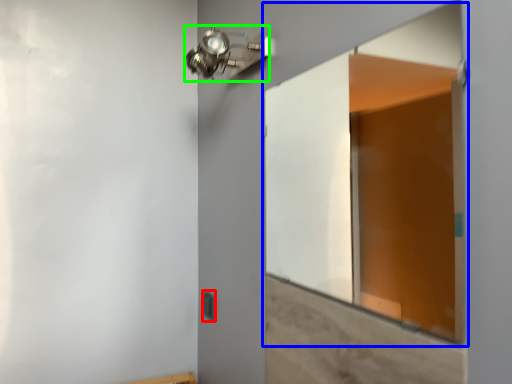
Question: Based on their relative distances, which object is nearer to light switch (highlighted by a red box)? Choose from window (highlighted by a blue box) and light fixture (highlighted by a green box).

Choices:
 (A) window
 (B) light fixture

Answer: (B)